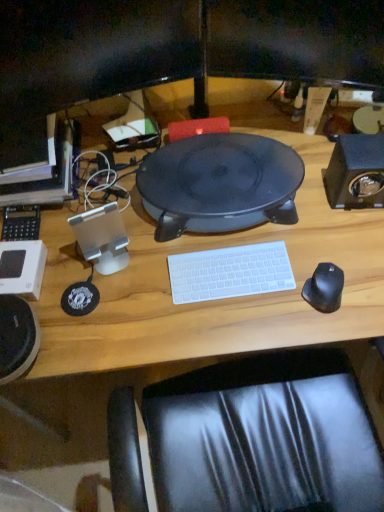
Image resolution: width=384 pixels, height=512 pixels. Find the location of `free space in front of black matte mouse at right`. free space in front of black matte mouse at right is located at coordinates (329, 327).